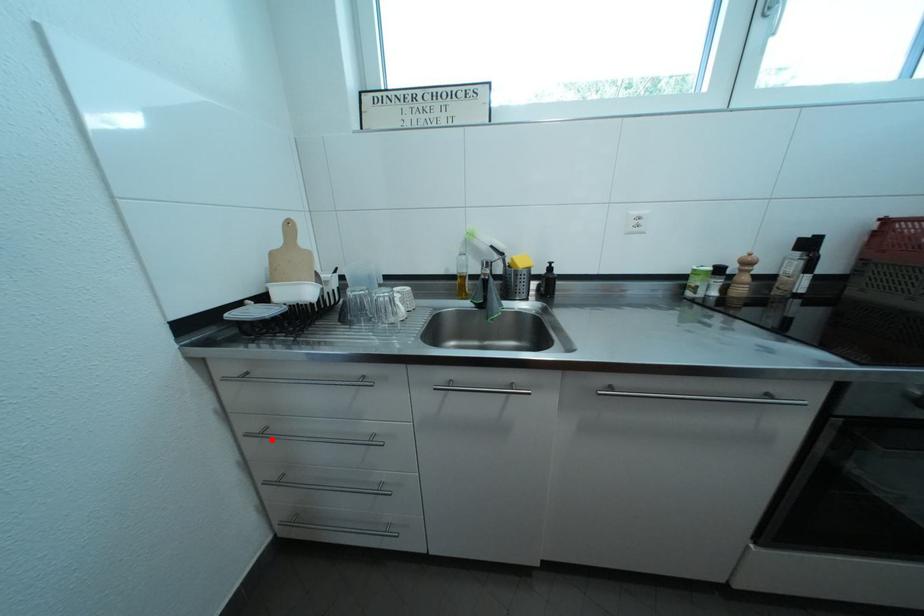
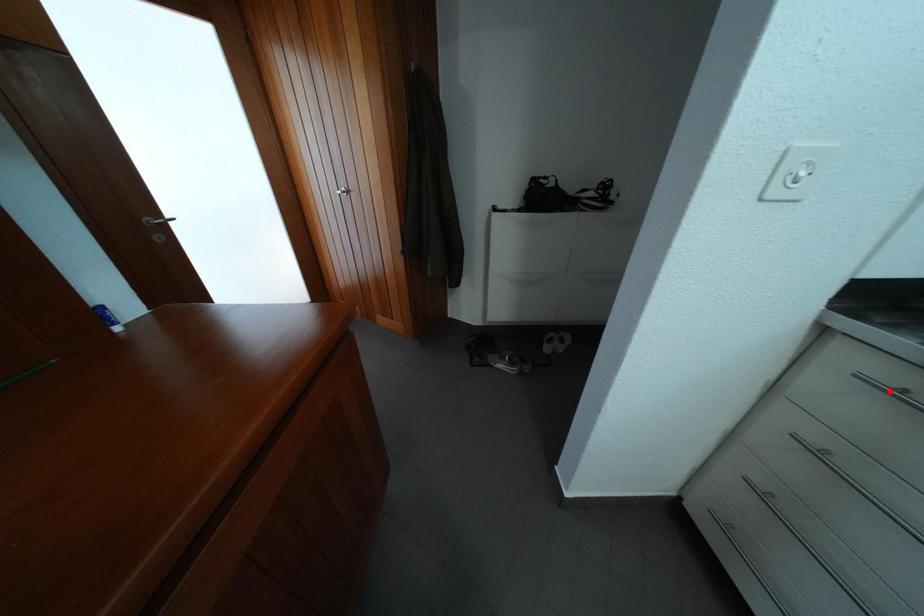
I am providing you with two images of the same scene from different viewpoints. A red point is marked on the first image and another point is marked on the second image. Is the red point in image1 aligned with the point shown in image2?

No